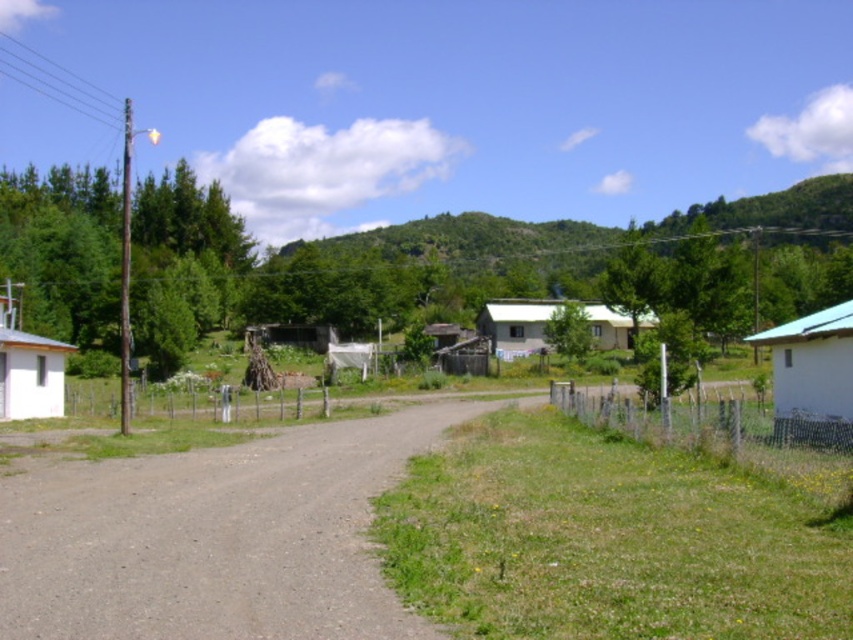
Between white matte hut at right and white matte house at center, which one appears on the left side from the viewer's perspective?

white matte house at center is more to the left.

Which is above, white matte hut at right or white matte house at center?

white matte house at center is higher up.

Between point (810, 428) and point (508, 342), which one is positioned in front?

Point (810, 428) is more forward.

Locate an element on the screen. white matte hut at right is located at coordinates (811, 378).

In the scene shown: Is gray gravel road at center below white matte hut at left?

Indeed, gray gravel road at center is positioned under white matte hut at left.

Locate an element on the screen. Image resolution: width=853 pixels, height=640 pixels. gray gravel road at center is located at coordinates (215, 536).

Between white matte hut at right and green wire mesh fence at center, which one is positioned lower?

green wire mesh fence at center is lower down.

This screenshot has height=640, width=853. What do you see at coordinates (811, 378) in the screenshot?
I see `white matte hut at right` at bounding box center [811, 378].

Locate an element on the screen. The width and height of the screenshot is (853, 640). white matte hut at right is located at coordinates (811, 378).